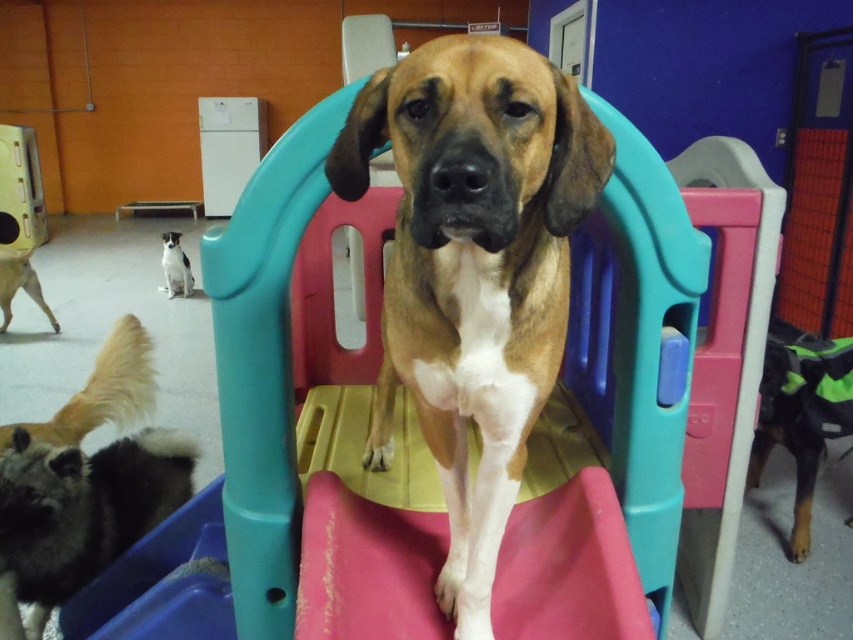
In the scene shown: Can you confirm if black and green fabric dog at lower right is bigger than white fur at center?

Yes.

Is the position of black and green fabric dog at lower right more distant than that of white fur at center?

No.

Who is more forward, (815, 406) or (190, 291)?

Positioned in front is point (815, 406).

What are the coordinates of `black and green fabric dog at lower right` in the screenshot? It's located at (801, 412).

The width and height of the screenshot is (853, 640). What do you see at coordinates (473, 269) in the screenshot? I see `brown matte dog at center` at bounding box center [473, 269].

Can you confirm if brown matte dog at center is taller than golden fur dog at lower left?

Indeed, brown matte dog at center has a greater height compared to golden fur dog at lower left.

Does point (430, 364) come in front of point (32, 282)?

That is True.

You are a GUI agent. You are given a task and a screenshot of the screen. Output one action in this format:
    pyautogui.click(x=<x>, y=<y>)
    Task: Click on the brown matte dog at center
    The width and height of the screenshot is (853, 640).
    Given the screenshot: What is the action you would take?
    pyautogui.click(x=473, y=269)

Which is more to the left, fluffy gray dog at lower left or golden fur dog at lower left?

golden fur dog at lower left is more to the left.

Between point (45, 468) and point (4, 262), which one is positioned behind?

The point (4, 262) is behind.

I want to click on fluffy gray dog at lower left, so click(x=83, y=509).